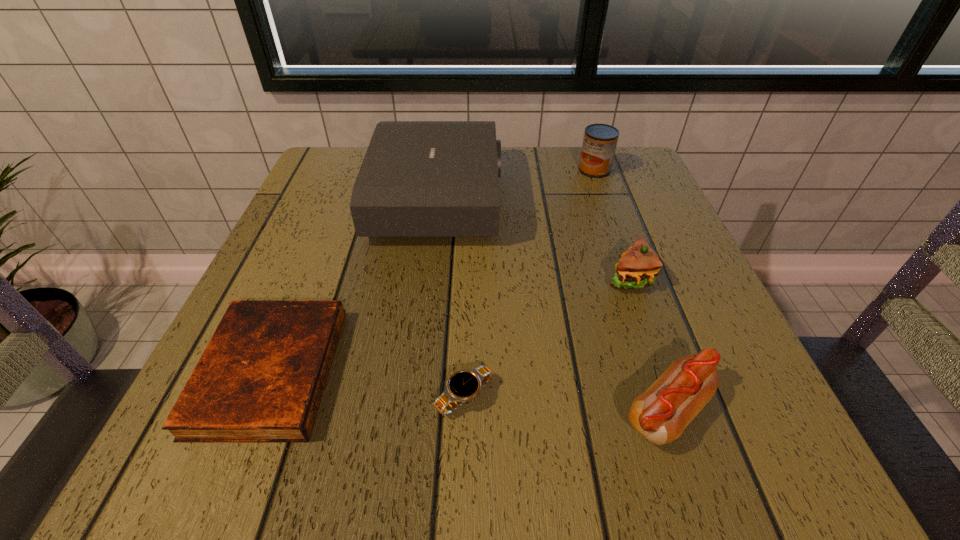
Locate an element on the screen. The height and width of the screenshot is (540, 960). projector is located at coordinates (418, 178).

This screenshot has width=960, height=540. What are the coordinates of `can` in the screenshot? It's located at (600, 140).

Where is `sandwich`? sandwich is located at coordinates click(x=638, y=266).

At what (x,y) coordinates should I click in order to perform the action: click on the third shortest object. Please return your answer as a coordinate pair (x, y). The height and width of the screenshot is (540, 960). Looking at the image, I should click on (660, 414).

Locate an element on the screen. This screenshot has width=960, height=540. Bible is located at coordinates (261, 378).

Identify the location of watch. The height and width of the screenshot is (540, 960). (463, 385).

The width and height of the screenshot is (960, 540). Find the location of `free space located 0.150m on the front-facing side of the projector`. free space located 0.150m on the front-facing side of the projector is located at coordinates (569, 198).

In order to click on free location located 0.370m on the left of the can in this screenshot , I will do `click(423, 170)`.

The height and width of the screenshot is (540, 960). In order to click on free space located 0.170m on the left of the sandwich in this screenshot , I will do `click(510, 278)`.

This screenshot has height=540, width=960. What are the coordinates of `vacant space located on the left of the sausage` in the screenshot? It's located at (324, 411).